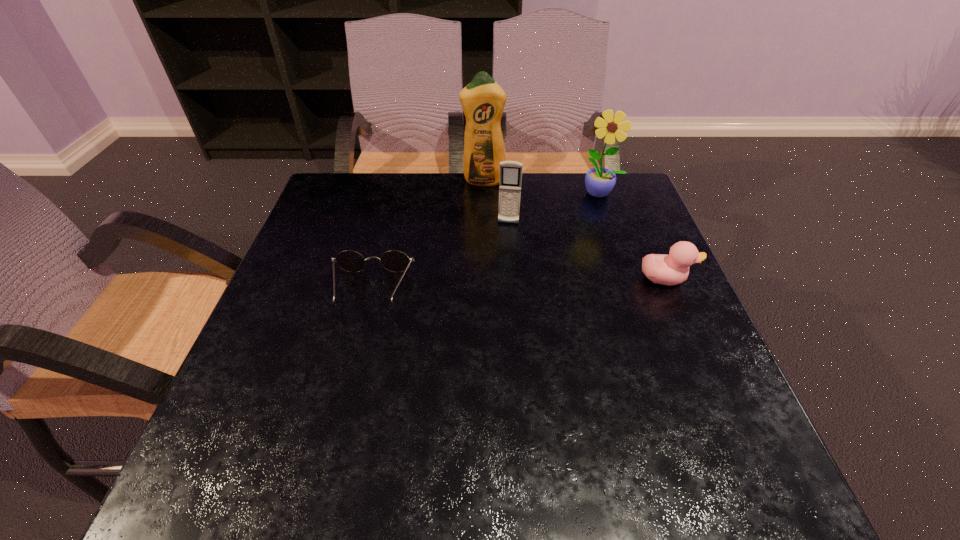
At what (x,y) coordinates should I click in order to perform the action: click on free space at the far right corner of the desktop. Please return your answer as a coordinate pair (x, y). Looking at the image, I should click on (600, 202).

In order to click on empty space between the tallest object and the third farthest object in this screenshot , I will do `click(496, 202)`.

At what (x,y) coordinates should I click in order to perform the action: click on vacant area between the third shortest object and the second shortest object. Please return your answer as a coordinate pair (x, y). Looking at the image, I should click on (587, 251).

Image resolution: width=960 pixels, height=540 pixels. I want to click on free area in between the detergent and the shortest object, so click(x=427, y=235).

The width and height of the screenshot is (960, 540). Find the location of `unoccupied position between the tallest object and the spectacles`. unoccupied position between the tallest object and the spectacles is located at coordinates (427, 235).

Where is `free space that is in between the detergent and the duckling`? The height and width of the screenshot is (540, 960). free space that is in between the detergent and the duckling is located at coordinates (574, 230).

Find the location of a particular element. The width and height of the screenshot is (960, 540). free space between the sunflower and the spectacles is located at coordinates (486, 241).

Image resolution: width=960 pixels, height=540 pixels. Find the location of `blank region between the cellular telephone and the spectacles`. blank region between the cellular telephone and the spectacles is located at coordinates (440, 256).

This screenshot has height=540, width=960. Find the location of `free space between the duckling and the third shortest object`. free space between the duckling and the third shortest object is located at coordinates (587, 251).

This screenshot has height=540, width=960. What are the coordinates of `empty space that is in between the tallest object and the second tallest object` in the screenshot? It's located at (541, 187).